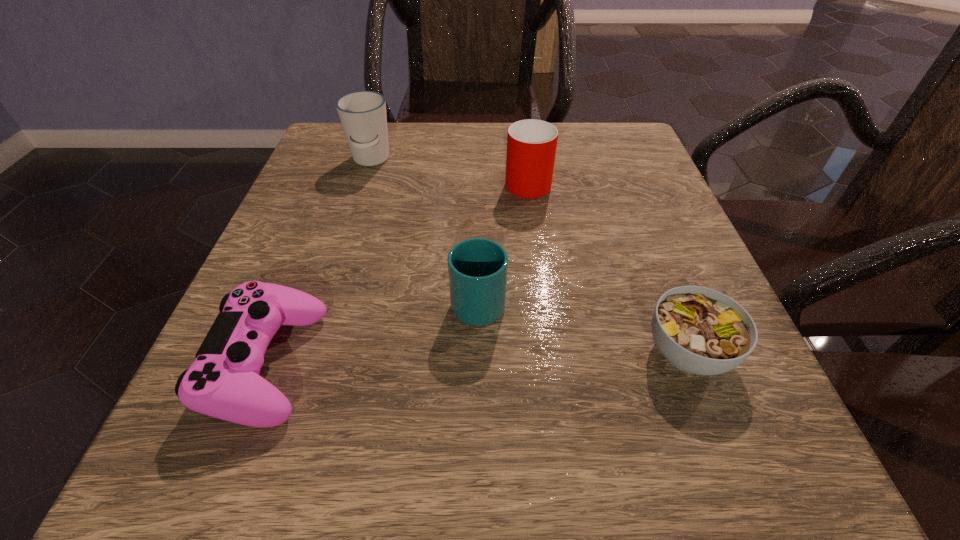
The image size is (960, 540). Identify the location of free space between the leftmost cup and the fourth object from left to right. (449, 170).

You are a GUI agent. You are given a task and a screenshot of the screen. Output one action in this format:
    pyautogui.click(x=<x>, y=<y>)
    Task: Click on the empty space between the nearest cup and the control
    Image resolution: width=960 pixels, height=540 pixels.
    Given the screenshot: What is the action you would take?
    pyautogui.click(x=373, y=332)

The height and width of the screenshot is (540, 960). Find the location of `vacant area that lies between the soup bowl and the control`. vacant area that lies between the soup bowl and the control is located at coordinates (478, 357).

At what (x,y) coordinates should I click in order to perform the action: click on free space between the leftmost cup and the shortest cup. Please return your answer as a coordinate pair (x, y). This screenshot has width=960, height=540. Looking at the image, I should click on (424, 230).

This screenshot has width=960, height=540. Find the location of `object that stands as the third closest to the control`. object that stands as the third closest to the control is located at coordinates (531, 144).

Where is `object that is the second closest to the control`? The image size is (960, 540). object that is the second closest to the control is located at coordinates (362, 114).

This screenshot has height=540, width=960. I want to click on cup that stands as the closest to the leftmost cup, so click(531, 144).

You are a GUI agent. You are given a task and a screenshot of the screen. Output one action in this format:
    pyautogui.click(x=<x>, y=<y>)
    Task: Click on the cup that is the third closest one to the control
    
    Given the screenshot: What is the action you would take?
    pyautogui.click(x=531, y=144)

This screenshot has width=960, height=540. I want to click on vacant region that satisfies the following two spatial constraints: 1. on the back side of the control; 2. on the left side of the soup bowl, so click(273, 352).

Locate an element on the screen. The height and width of the screenshot is (540, 960). vacant point that satisfies the following two spatial constraints: 1. on the back side of the control; 2. on the left side of the soup bowl is located at coordinates (273, 352).